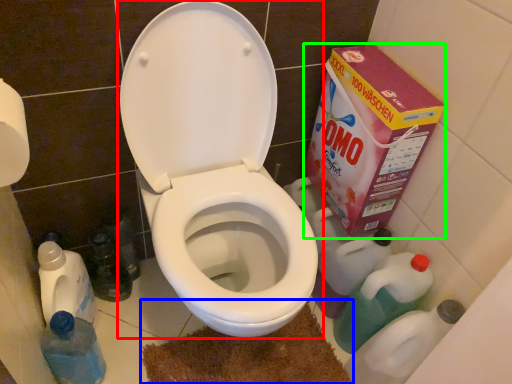
Question: Estimate the real-world distances between objects in this image. Which object is closer to toilet (highlighted by a red box), bath mat (highlighted by a blue box) or cardboard box (highlighted by a green box)?

Choices:
 (A) bath mat
 (B) cardboard box

Answer: (B)